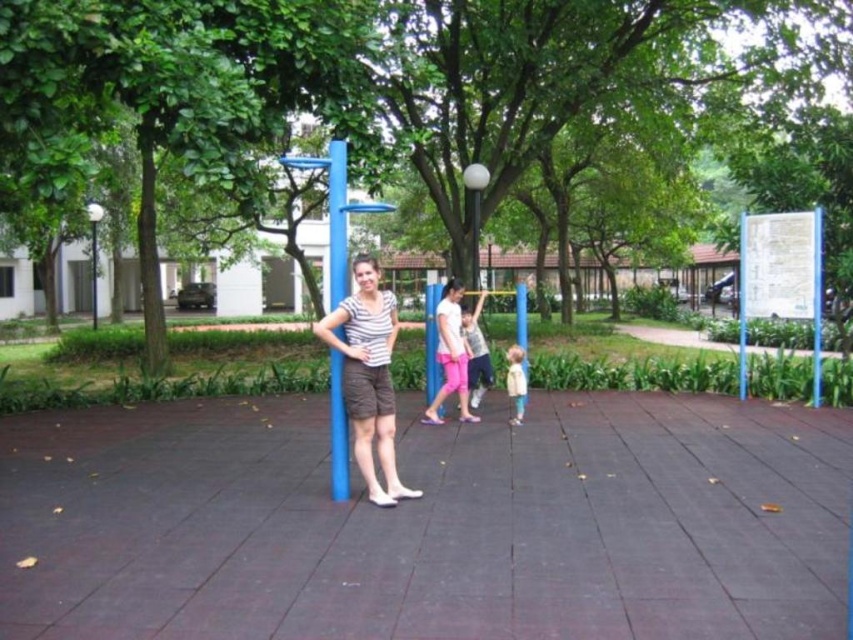
Who is more distant from viewer, (346, 228) or (459, 296)?

Point (459, 296)

Between point (346, 218) and point (447, 310), which one is positioned in front?

Positioned in front is point (346, 218).

Between point (345, 465) and point (421, 422), which one is positioned behind?

The point (421, 422) is behind.

The height and width of the screenshot is (640, 853). Find the location of `blue metallic pole at center`. blue metallic pole at center is located at coordinates (337, 221).

Does point (457, 355) lie in front of point (479, 310)?

Yes, it is.

Is pink fabric pants at center positioned behind light brown fabric shirt at center?

No, it is in front of light brown fabric shirt at center.

Who is more forward, (445, 332) or (469, 378)?

Point (445, 332) is more forward.

The width and height of the screenshot is (853, 640). I want to click on pink fabric pants at center, so click(x=451, y=353).

Looking at this image, can you confirm if light brown fabric shirt at center is shorter than light beige fabric jacket at lower right?

In fact, light brown fabric shirt at center may be taller than light beige fabric jacket at lower right.

Does light brown fabric shirt at center appear on the left side of light beige fabric jacket at lower right?

Correct, you'll find light brown fabric shirt at center to the left of light beige fabric jacket at lower right.

Measure the distance between light brown fabric shirt at center and camera.

A distance of 8.87 meters exists between light brown fabric shirt at center and camera.

The image size is (853, 640). Identify the location of light brown fabric shirt at center. (476, 355).